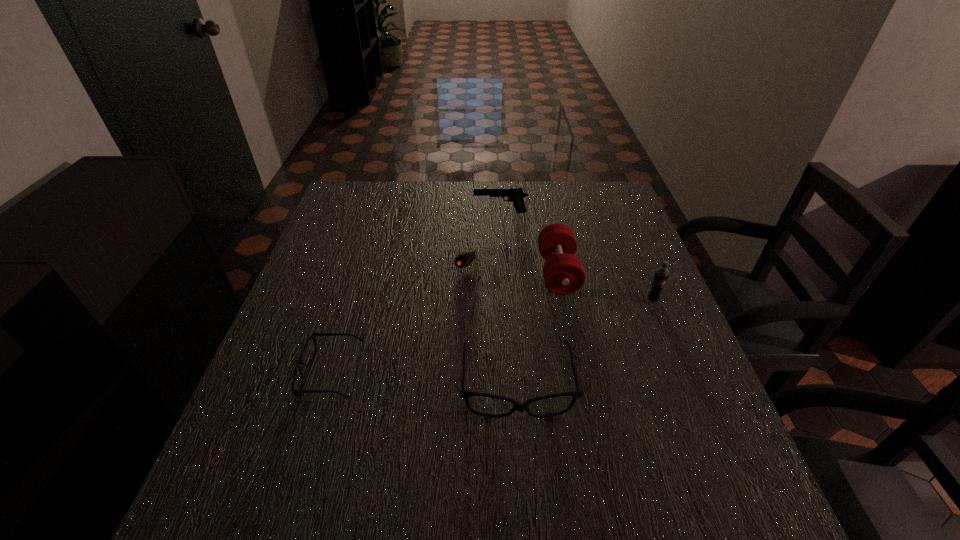
Find the location of `object that is positioned at the right edge`. object that is positioned at the right edge is located at coordinates (661, 275).

Locate an element on the screen. Image resolution: width=960 pixels, height=540 pixels. vacant area at the far edge of the desktop is located at coordinates (449, 193).

In the image, there is a desktop. What are the coordinates of `vacant space at the near edge` in the screenshot? It's located at (552, 430).

You are a GUI agent. You are given a task and a screenshot of the screen. Output one action in this format:
    pyautogui.click(x=<x>, y=<y>)
    Task: Click on the free space at the left edge
    
    Given the screenshot: What is the action you would take?
    pyautogui.click(x=381, y=228)

Locate an element on the screen. Image resolution: width=960 pixels, height=540 pixels. free location at the right edge of the desktop is located at coordinates (686, 389).

In the image, there is a desktop. Identify the location of free space at the far left corner. pyautogui.click(x=360, y=201).

Find the location of `free space at the near left corner of the desktop`. free space at the near left corner of the desktop is located at coordinates (280, 456).

The image size is (960, 540). I want to click on vacant point at the far right corner, so click(608, 215).

Where is `free spot between the dumbbell and the soda`? The height and width of the screenshot is (540, 960). free spot between the dumbbell and the soda is located at coordinates (606, 286).

Image resolution: width=960 pixels, height=540 pixels. I want to click on free space between the soda and the taller spectacles, so click(x=585, y=342).